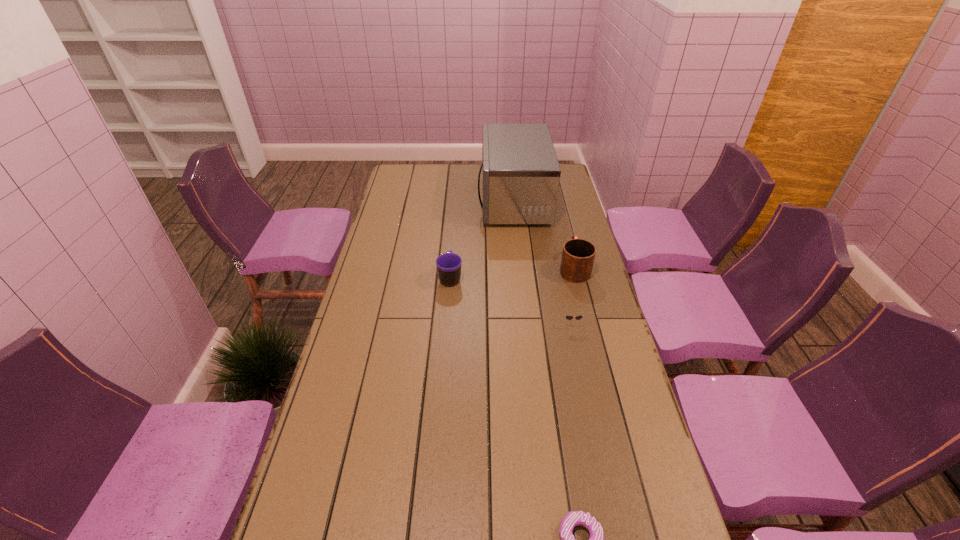
Locate an element on the screen. vacant area situated 0.140m on the front-facing side of the farthest object is located at coordinates (447, 200).

Find the location of a particular element. This screenshot has width=960, height=540. free space located 0.200m on the side of the taller mug with the handle is located at coordinates point(564,224).

This screenshot has height=540, width=960. What are the coordinates of `blank space located 0.240m on the side of the taller mug with the handle` in the screenshot? It's located at (562, 219).

Where is `vacant space located on the side of the taller mug with the handle`? The height and width of the screenshot is (540, 960). vacant space located on the side of the taller mug with the handle is located at coordinates (559, 207).

Find the location of `vacant space located 0.300m with the handle on the side of the left mug`. vacant space located 0.300m with the handle on the side of the left mug is located at coordinates (454, 221).

Identify the location of vacant area situated 0.060m with the handle on the side of the left mug. This screenshot has width=960, height=540. (452, 256).

Identify the location of free space located 0.170m with the handle on the side of the left mug. The height and width of the screenshot is (540, 960). (453, 240).

You are a GUI agent. You are given a task and a screenshot of the screen. Output one action in this format:
    pyautogui.click(x=<x>, y=<y>)
    Task: Click on the blank area located in front of the lenses of the second shortest object
    The height and width of the screenshot is (540, 960).
    Given the screenshot: What is the action you would take?
    pyautogui.click(x=581, y=367)

In order to click on object that is at the far edge in this screenshot , I will do point(521,174).

At what (x,y) coordinates should I click in order to perform the action: click on microwave oven located in the right edge section of the desktop. Please return your answer as a coordinate pair (x, y). Looking at the image, I should click on (521, 174).